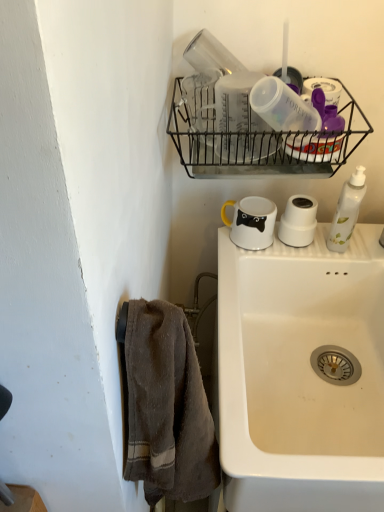
Where is `vacant area that is in front of white matte toilet paper at upper center`? This screenshot has height=512, width=384. vacant area that is in front of white matte toilet paper at upper center is located at coordinates (293, 258).